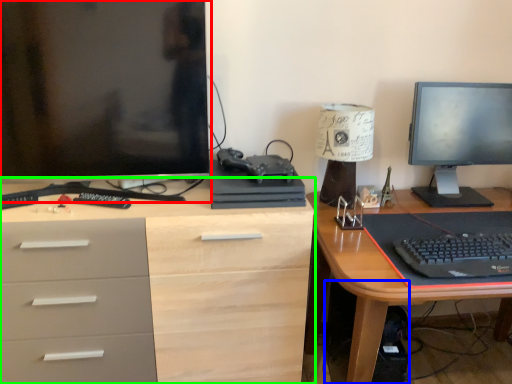
Question: Which object is positioned farthest from computer monitor (highlighted by a red box)? Select from computer tower (highlighted by a blue box) and desk (highlighted by a green box).

Choices:
 (A) computer tower
 (B) desk

Answer: (A)